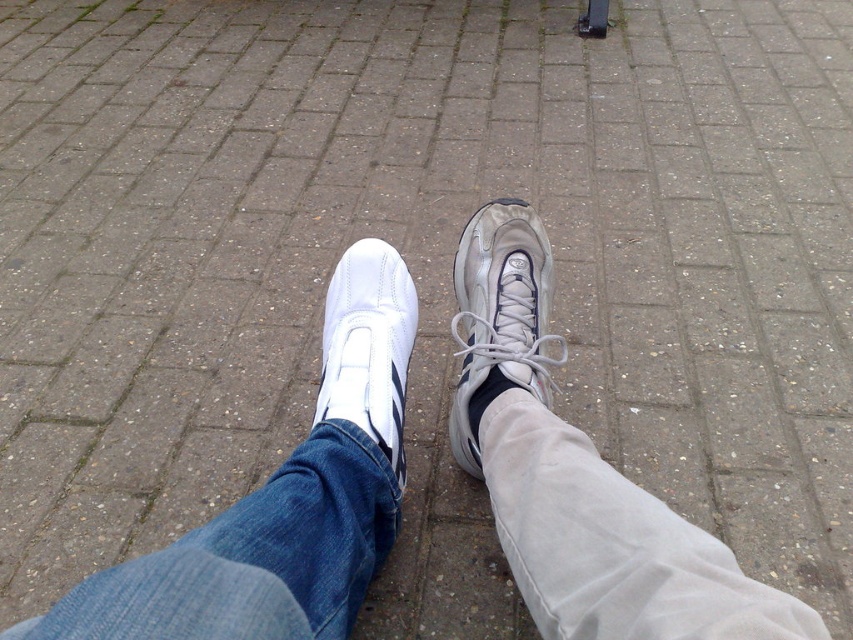
Question: Based on their relative distances, which object is nearer to the suede-like gray ankle at center?

Choices:
 (A) white leather shoe at left
 (B) satin silver sneaker at center

Answer: (B)

Question: Which of these objects is positioned farthest from the suede-like gray ankle at center?

Choices:
 (A) white leather shoe at left
 (B) satin silver sneaker at center

Answer: (A)

Question: Is satin silver sneaker at center positioned in front of suede-like gray ankle at center?

Choices:
 (A) yes
 (B) no

Answer: (B)

Question: Does white leather shoe at left have a smaller size compared to suede-like gray ankle at center?

Choices:
 (A) yes
 (B) no

Answer: (B)

Question: Among these points, which one is farthest from the camera?

Choices:
 (A) (410, 346)
 (B) (515, 316)
 (C) (500, 371)

Answer: (A)

Question: Considering the relative positions of white leather shoe at left and suede-like gray ankle at center in the image provided, where is white leather shoe at left located with respect to suede-like gray ankle at center?

Choices:
 (A) left
 (B) right

Answer: (A)